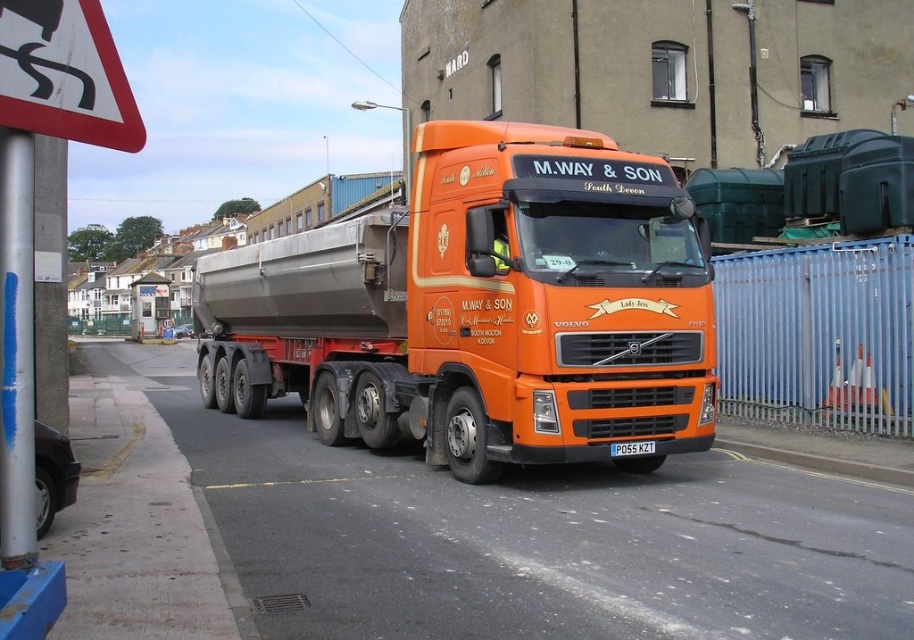
You are a delivery driver planning to park the orange matte truck at center in a parking spot that is exactly the same width as the red plastic triangle at upper left. Can the truck fit into the parking spot without overlapping the sides?

The orange matte truck at center might be wider than the red plastic triangle at upper left, so there is a possibility that the truck will not fit into the parking spot without overlapping the sides.

You are a delivery driver who needs to park your orange matte truck at center under a low bridge. There is a red plastic triangle at upper left indicating the maximum height limit. Based on the scene, can your truck pass under the bridge without hitting the structure?

The orange matte truck at center is much taller than the red plastic triangle at upper left, which indicates the height limit. Therefore, the truck cannot pass under the bridge without hitting the structure.

Based on the photo, you are standing in front of the orange Volvo truck with the trailer. There are two points marked on the truck. One is at coordinates point [372,438] and the other is at point [48,26]. Which point is closer to you?

Point [48,26] is closer to you because it is not as far as point [372,438] which is further away.